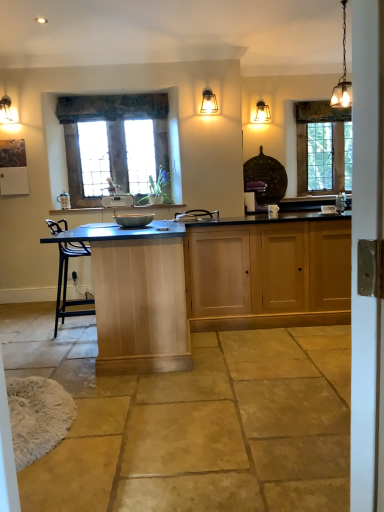
This screenshot has height=512, width=384. I want to click on free space in front of light wood cabinet at center, marked as the 2th cabinetry in a right-to-left arrangement, so click(152, 410).